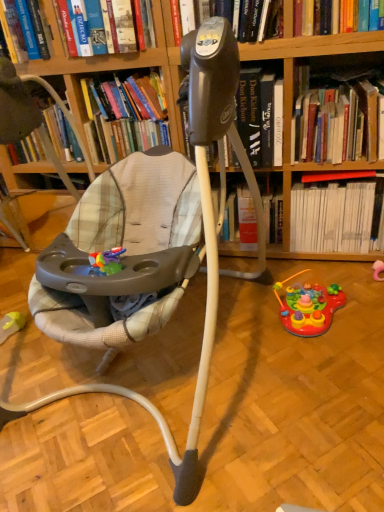
The image size is (384, 512). I want to click on free space underneath plush fabric baby carriage at center (from a real-world perspective), so click(140, 370).